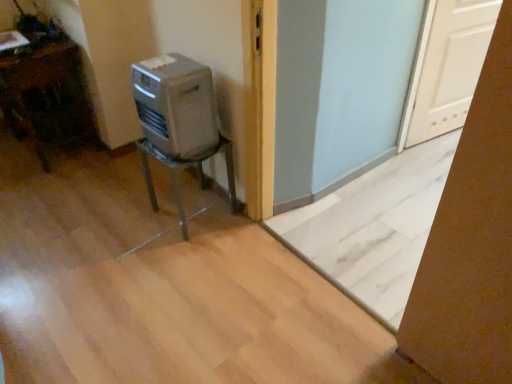
Question: In terms of width, does silver metallic heater at center look wider or thinner when compared to white matte door at upper right?

Choices:
 (A) wide
 (B) thin

Answer: (A)

Question: From a real-world perspective, relative to white matte door at upper right, is silver metallic heater at center vertically above or below?

Choices:
 (A) above
 (B) below

Answer: (A)

Question: Considering the real-world distances, which object is closest to the brown cardboard box at lower right?

Choices:
 (A) silver metallic heater at center
 (B) white matte door at upper right
 (C) wooden table at left, the 2th furniture positioned from the right
 (D) metallic gray chair at center-left, which is the first furniture in right-to-left order

Answer: (A)

Question: Which of these objects is positioned farthest from the white matte door at upper right?

Choices:
 (A) wooden table at left, the 2th furniture positioned from the right
 (B) brown cardboard box at lower right
 (C) silver metallic heater at center
 (D) metallic gray chair at center-left, which appears as the 2th furniture when viewed from the left

Answer: (A)